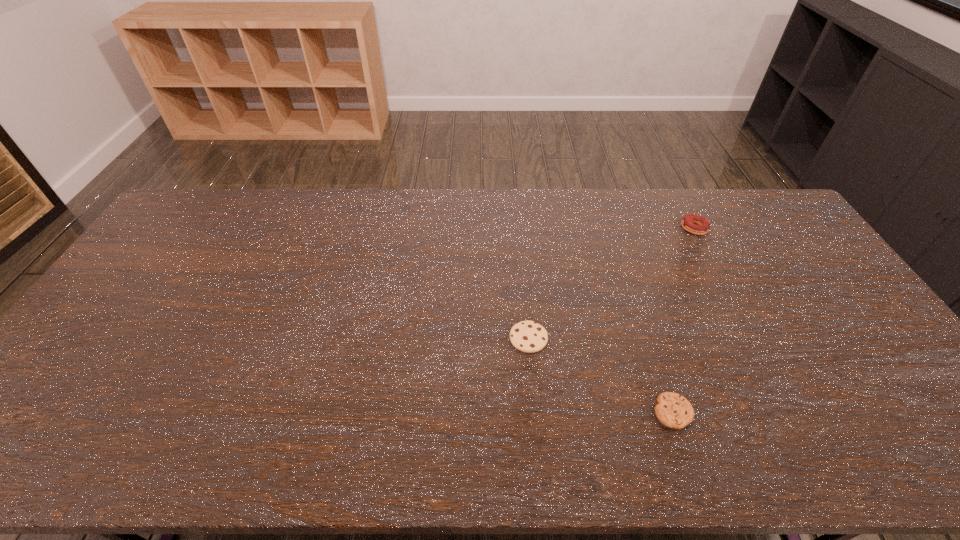
You are a GUI agent. You are given a task and a screenshot of the screen. Output one action in this format:
    pyautogui.click(x=<x>, y=<y>)
    Task: Click on the object present at the near edge
    
    Given the screenshot: What is the action you would take?
    tap(674, 411)

This screenshot has width=960, height=540. Identify the location of vacant space at the far edge of the desktop. (356, 218).

Identify the location of vacant space at the near edge of the desktop. The width and height of the screenshot is (960, 540). (501, 433).

This screenshot has width=960, height=540. In the image, there is a desktop. Find the location of `vacant space at the left edge`. vacant space at the left edge is located at coordinates [x=179, y=280].

The height and width of the screenshot is (540, 960). In the image, there is a desktop. What are the coordinates of `vacant area at the right edge` in the screenshot? It's located at (918, 411).

At what (x,y) coordinates should I click in order to perform the action: click on free spot between the doughnut and the nearest object. Please return your answer as a coordinate pair (x, y). Image resolution: width=960 pixels, height=540 pixels. Looking at the image, I should click on (684, 320).

At what (x,y) coordinates should I click in order to perform the action: click on vacant area between the rightmost object and the shorter cookie. Please return your answer as a coordinate pair (x, y). This screenshot has width=960, height=540. Looking at the image, I should click on (684, 320).

You are a GUI agent. You are given a task and a screenshot of the screen. Output one action in this format:
    pyautogui.click(x=<x>, y=<y>)
    Task: Click on the free point between the leftmost object and the right cookie
    This screenshot has height=540, width=960.
    Given the screenshot: What is the action you would take?
    pyautogui.click(x=601, y=375)

At what (x,y) coordinates should I click in order to perform the action: click on empty location between the leftmost object and the farthest object. Please return your answer as a coordinate pair (x, y). This screenshot has width=960, height=540. Looking at the image, I should click on (612, 284).

This screenshot has height=540, width=960. In order to click on unoccupied position between the second farthest object and the shortest object in this screenshot , I will do `click(601, 375)`.